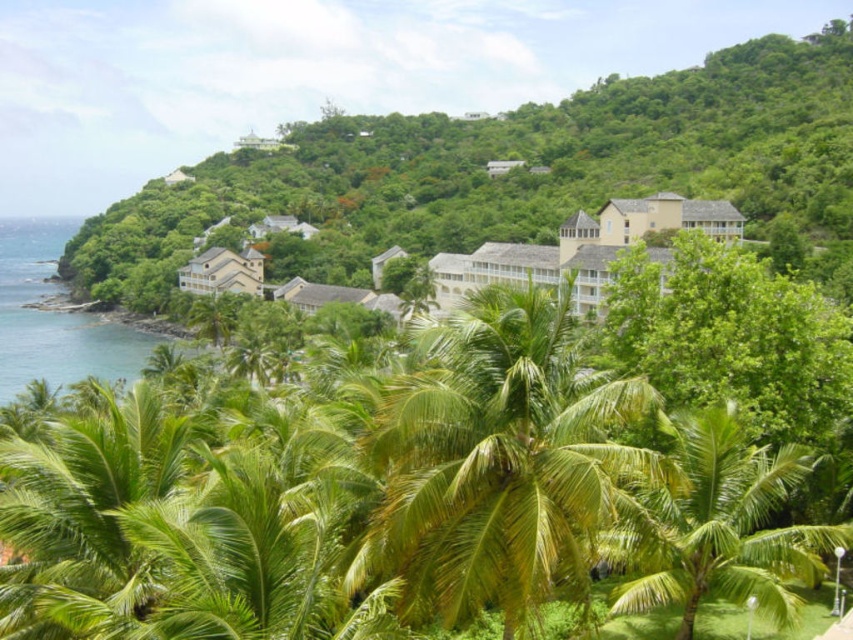
You are a maintenance worker who needs to water two palm trees. You have a watering can that can hold enough water for 5 meters of travel. You are standing at the green leafy palm tree at center. Can you reach the green leafy palm tree at lower right without refilling your watering can?

The distance between the green leafy palm tree at center and the green leafy palm tree at lower right is 4.76 meters. Since the watering can allows for 5 meters of travel, you can reach the green leafy palm tree at lower right without needing to refill.